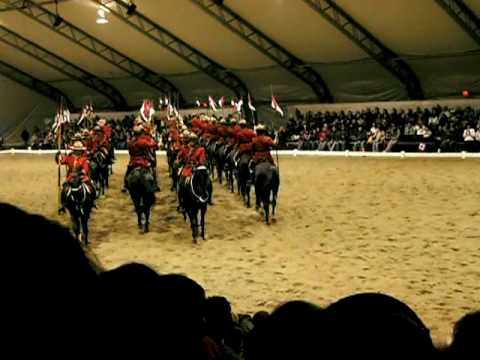
Locate an element on the screen. The height and width of the screenshot is (360, 480). rafters is located at coordinates (245, 31).